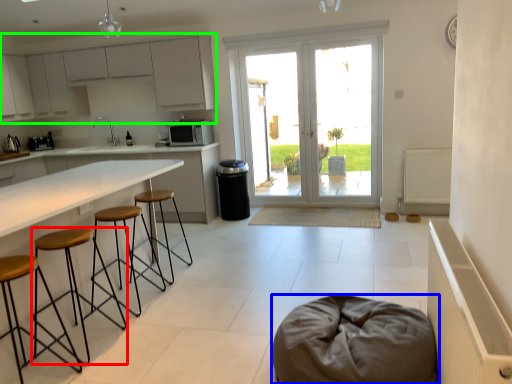
Question: Estimate the real-world distances between objects in this image. Which object is closer to stool (highlighted by a red box), furniture (highlighted by a blue box) or cabinetry (highlighted by a green box)?

Choices:
 (A) furniture
 (B) cabinetry

Answer: (A)